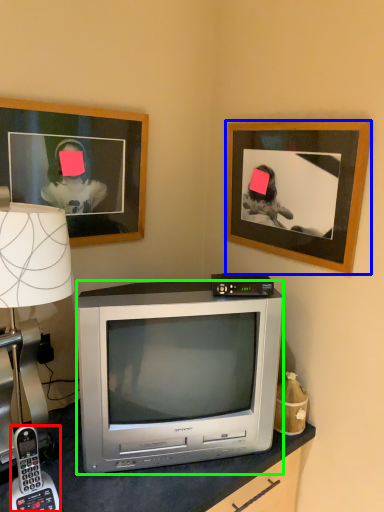
Question: Which object is the farthest from corded phone (highlighted by a red box)? Choose among these: picture frame (highlighted by a blue box) or television (highlighted by a green box).

Choices:
 (A) picture frame
 (B) television

Answer: (A)